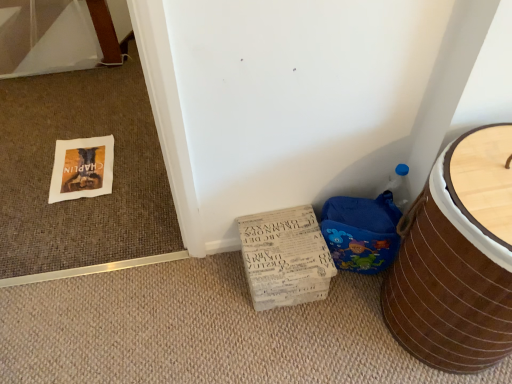
Describe the element at coordinates (285, 257) in the screenshot. This screenshot has height=384, width=512. I see `white cardboard box at lower center` at that location.

Where is `brown woven basket at lower right`? Image resolution: width=512 pixels, height=384 pixels. brown woven basket at lower right is located at coordinates (452, 271).

Can you confirm if brown woven basket at lower right is thinner than white cardboard box at lower center?

No, brown woven basket at lower right is not thinner than white cardboard box at lower center.

Considering the relative sizes of brown woven basket at lower right and white cardboard box at lower center in the image provided, is brown woven basket at lower right shorter than white cardboard box at lower center?

Incorrect, the height of brown woven basket at lower right does not fall short of that of white cardboard box at lower center.

From the image's perspective, who appears lower, brown woven basket at lower right or white cardboard box at lower center?

white cardboard box at lower center appears lower in the image.

Does point (371, 269) appear closer or farther from the camera than point (485, 158)?

Point (371, 269) is positioned farther from the camera compared to point (485, 158).

Consider the image. Does blue fabric potty at lower right lie in front of brown woven basket at lower right?

That is False.

Between blue fabric potty at lower right and brown woven basket at lower right, which one has more height?

With more height is brown woven basket at lower right.

From the image's perspective, which object appears higher, blue fabric potty at lower right or brown woven basket at lower right?

blue fabric potty at lower right.

Choose the correct answer: Is brown woven basket at lower right inside blue fabric potty at lower right or outside it?

brown woven basket at lower right is spatially situated outside blue fabric potty at lower right.

Can you tell me how much brown woven basket at lower right and blue fabric potty at lower right differ in facing direction?

There is a 0.00194-degree angle between the facing directions of brown woven basket at lower right and blue fabric potty at lower right.

From a real-world perspective, which is physically below, brown woven basket at lower right or blue fabric potty at lower right?

blue fabric potty at lower right, from a real-world perspective.

Between white cardboard box at lower center and brown woven basket at lower right, which one has larger size?

brown woven basket at lower right.

Is white cardboard box at lower center completely or partially outside of brown woven basket at lower right?

Yes, white cardboard box at lower center is outside of brown woven basket at lower right.

Does white cardboard box at lower center lie in front of brown woven basket at lower right?

No, white cardboard box at lower center is further to the viewer.

Does blue fabric potty at lower right lie behind white cardboard box at lower center?

No.

From a real-world perspective, which is physically above, blue fabric potty at lower right or white cardboard box at lower center?

blue fabric potty at lower right, from a real-world perspective.

Is white cardboard box at lower center at the back of blue fabric potty at lower right?

No, blue fabric potty at lower right's orientation is not away from white cardboard box at lower center.

Can you confirm if blue fabric potty at lower right is taller than white cardboard box at lower center?

Correct, blue fabric potty at lower right is much taller as white cardboard box at lower center.

Would you say white cardboard box at lower center is to the left or to the right of blue fabric potty at lower right in the picture?

Based on their positions, white cardboard box at lower center is located to the left of blue fabric potty at lower right.

How different are the orientations of white cardboard box at lower center and blue fabric potty at lower right in degrees?

0.00135 degrees.

From the image's perspective, is white cardboard box at lower center positioned above or below blue fabric potty at lower right?

Clearly, from the image's perspective, white cardboard box at lower center is below blue fabric potty at lower right.

From a real-world perspective, is white cardboard box at lower center located higher than blue fabric potty at lower right?

No, from a real-world perspective, white cardboard box at lower center is not on top of blue fabric potty at lower right.

Image resolution: width=512 pixels, height=384 pixels. I want to click on furniture to the right of white cardboard box at lower center, so click(452, 271).

Where is `potty that appears below the brown woven basket at lower right (from a real-world perspective)`? potty that appears below the brown woven basket at lower right (from a real-world perspective) is located at coordinates (361, 232).

Estimate the real-world distances between objects in this image. Which object is closer to white cardboard box at lower center, blue fabric potty at lower right or brown woven basket at lower right?

blue fabric potty at lower right.

From the image, which object appears to be farther from blue fabric potty at lower right, brown woven basket at lower right or white cardboard box at lower center?

brown woven basket at lower right is positioned further to the anchor blue fabric potty at lower right.

Looking at the image, which one is located closer to blue fabric potty at lower right, white cardboard box at lower center or brown woven basket at lower right?

white cardboard box at lower center is positioned closer to the anchor blue fabric potty at lower right.

Considering their positions, is blue fabric potty at lower right positioned further to brown woven basket at lower right than white cardboard box at lower center?

Based on the image, white cardboard box at lower center appears to be further to brown woven basket at lower right.

Looking at the image, which one is located closer to white cardboard box at lower center, brown woven basket at lower right or blue fabric potty at lower right?

The object closer to white cardboard box at lower center is blue fabric potty at lower right.

Based on the photo, from the image, which object appears to be nearer to brown woven basket at lower right, white cardboard box at lower center or blue fabric potty at lower right?

The object closer to brown woven basket at lower right is blue fabric potty at lower right.

I want to click on potty between brown woven basket at lower right and white cardboard box at lower center along the z-axis, so click(x=361, y=232).